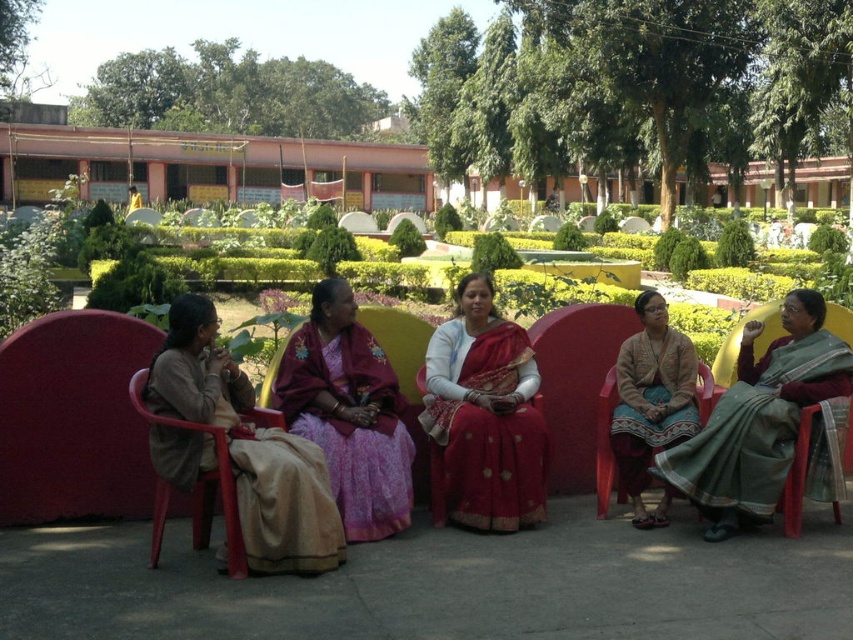
Between beige fabric saree at center and red silk saree at center, which one appears on the right side from the viewer's perspective?

From the viewer's perspective, red silk saree at center appears more on the right side.

Is point (160, 385) less distant than point (434, 330)?

Yes, point (160, 385) is closer to viewer.

Which is behind, point (311, 548) or point (436, 332)?

The point (436, 332) is more distant.

This screenshot has width=853, height=640. I want to click on beige fabric saree at center, so click(x=248, y=448).

Is green grass at center shorter than purple satin saree at center?

Incorrect, green grass at center's height does not fall short of purple satin saree at center's.

Does green grass at center appear over purple satin saree at center?

Yes.

Which is behind, point (285, 259) or point (317, 401)?

The point (285, 259) is behind.

The width and height of the screenshot is (853, 640). In order to click on green grass at center in this screenshot , I will do `click(189, 275)`.

Which is in front, point (474, 509) or point (41, 276)?

Point (474, 509) is in front.

Based on the photo, can you confirm if red silk saree at center is positioned to the left of green grass at center?

In fact, red silk saree at center is to the right of green grass at center.

Identify the location of red silk saree at center. This screenshot has height=640, width=853. (485, 417).